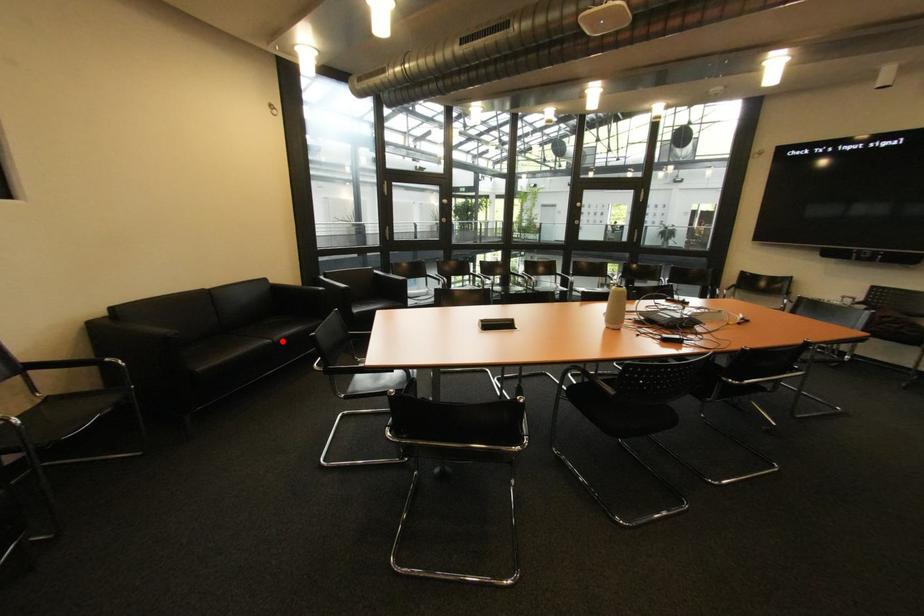
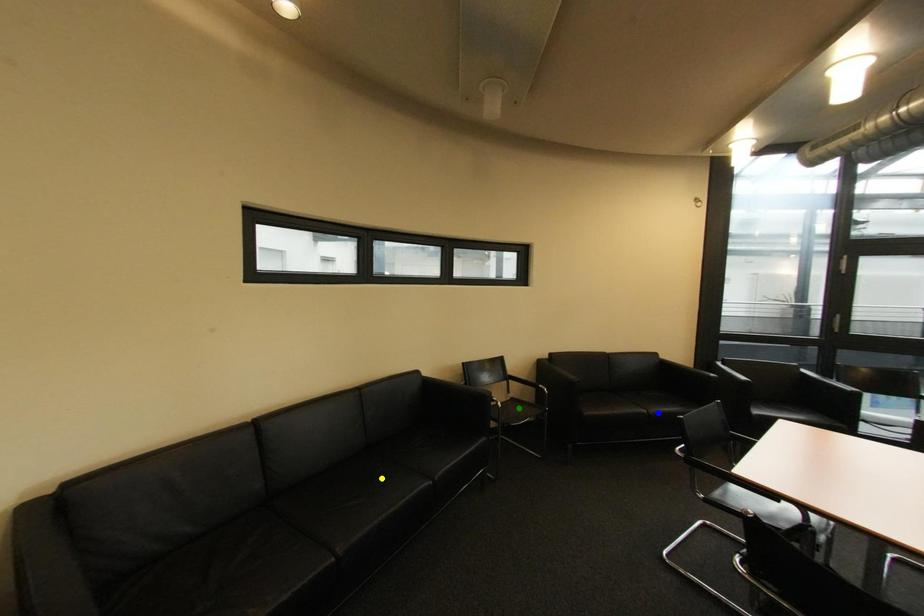
Question: I am providing you with two images of the same scene from different viewpoints. A red point is marked on the first image. You are given multiple points on the second image. Which mark in image 2 goes with the point in image 1?

Choices:
 (A) green point
 (B) blue point
 (C) yellow point

Answer: (B)